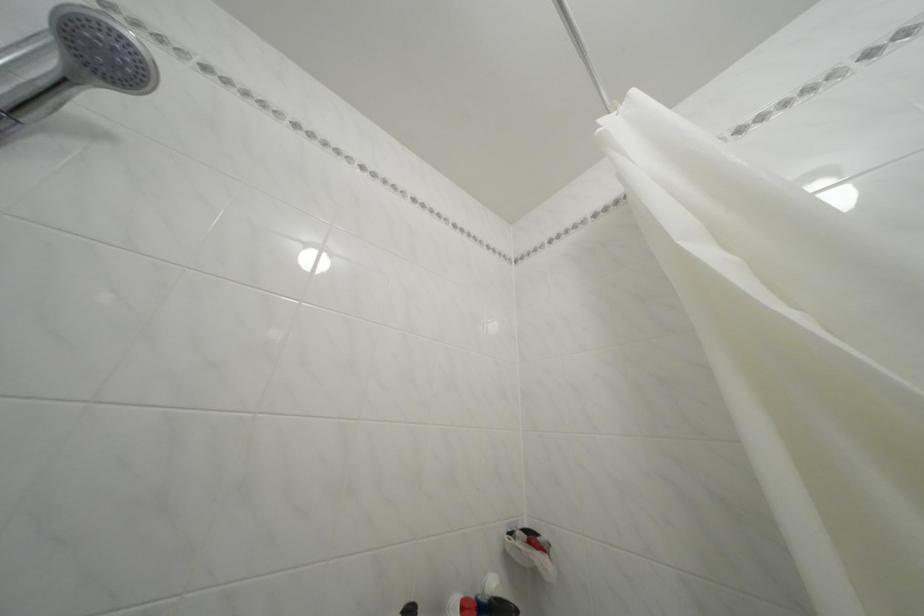
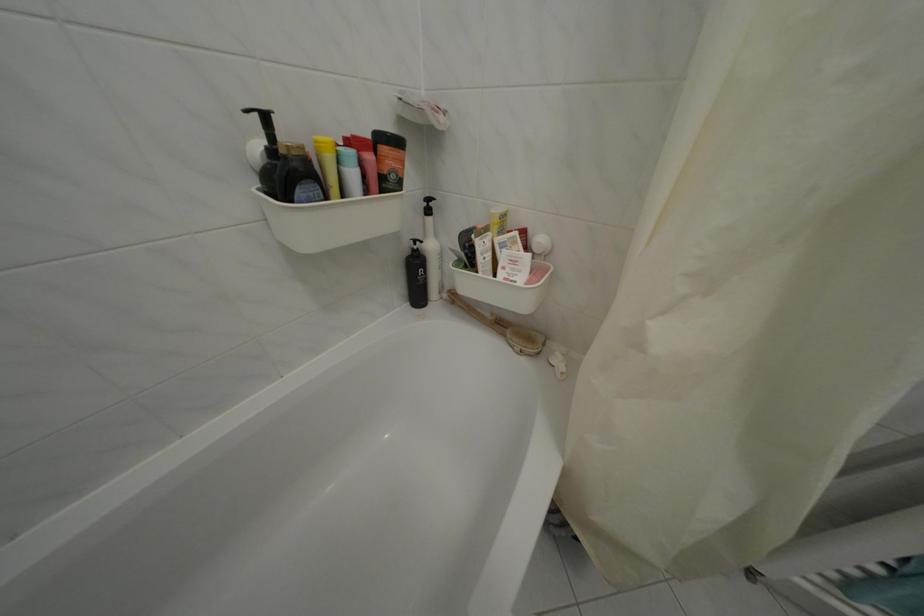
The first image is from the beginning of the video and the second image is from the end. How did the camera likely rotate when shooting the video?

The camera rotated toward right-down.